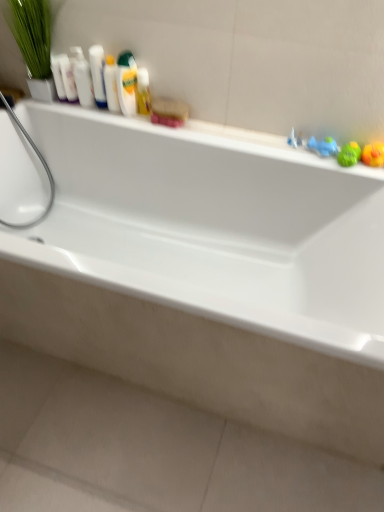
Question: Which is correct: yellow rubber duck at upper right, the first toy when ordered from right to left, is inside white glossy ledge at upper center, or outside of it?

Choices:
 (A) inside
 (B) outside

Answer: (B)

Question: In terms of width, does yellow rubber duck at upper right, the first toy when ordered from right to left, look wider or thinner when compared to white glossy ledge at upper center?

Choices:
 (A) thin
 (B) wide

Answer: (B)

Question: Which is farther from the white glossy ledge at upper center?

Choices:
 (A) translucent plastic mouthwash at upper center, marked as the 2th mouthwash in a right-to-left arrangement
 (B) yellow rubber duck at upper right, which appears as the third toy when viewed from the left
 (C) translucent plastic mouthwash at upper center, placed as the 6th mouthwash when sorted from left to right
 (D) white glossy bathtub at center
 (E) white glossy bottles at upper left

Answer: (B)

Question: Which object is positioned farthest from the blue rubber duck at upper right, marked as the first toy in a left-to-right arrangement?

Choices:
 (A) white glossy mouthwash at upper left, arranged as the first mouthwash when viewed from the left
 (B) white glossy mouthwash at upper left, the third mouthwash when ordered from left to right
 (C) translucent plastic mouthwash at upper center, the fifth mouthwash when ordered from left to right
 (D) white glossy bottles at upper left
 (E) green rubber duck at right, which is the 2th toy from left to right

Answer: (A)